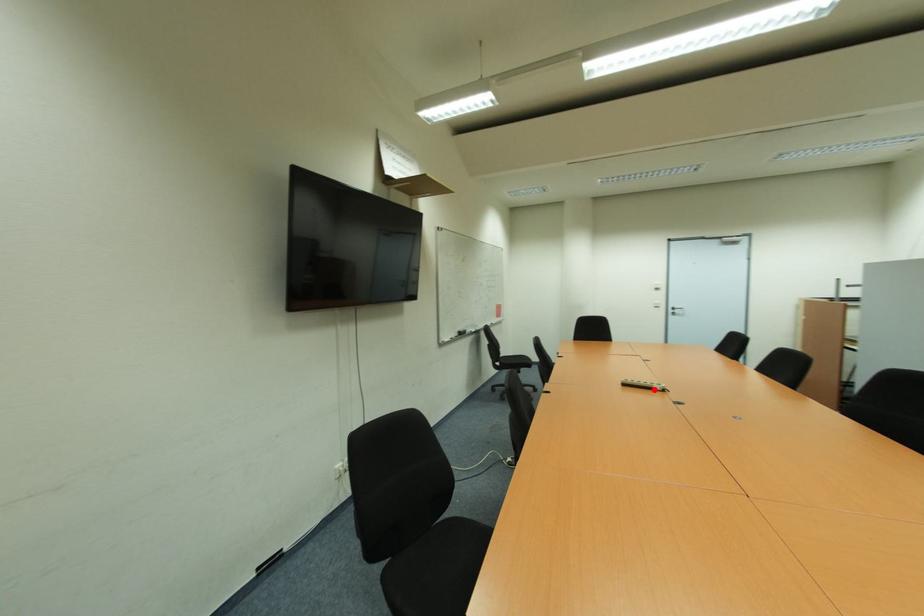
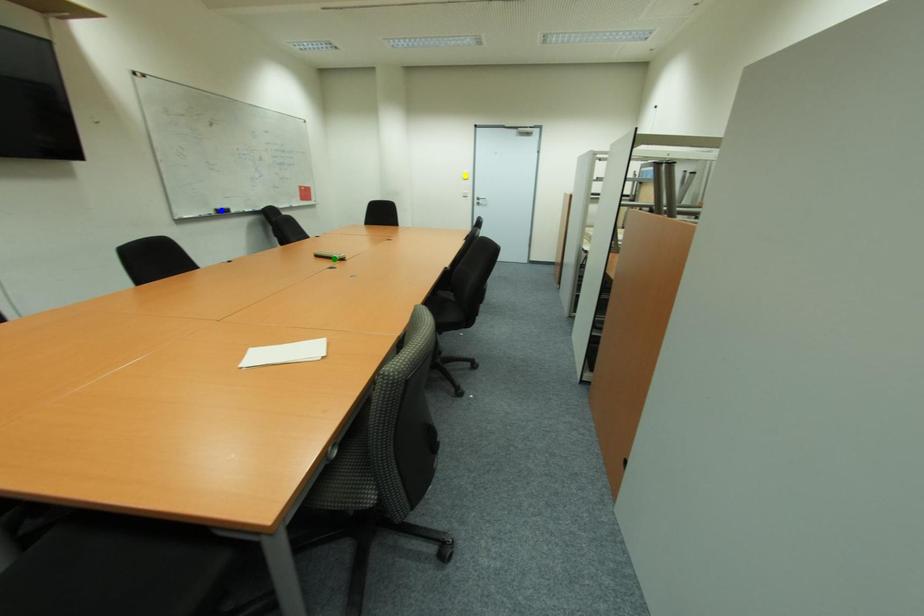
Question: I am providing you with two images of the same scene from different viewpoints. A red point is marked on the first image. You are given multiple points on the second image. Which mark in image 2 goes with the point in image 1?

Choices:
 (A) green point
 (B) yellow point
 (C) blue point

Answer: (A)